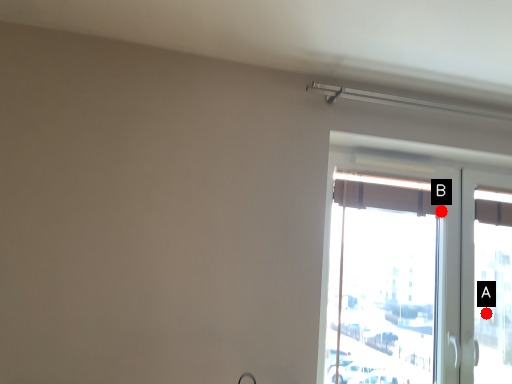
Question: Two points are circled on the image, labeled by A and B beside each circle. Among these points, which one is farthest from the camera?

Choices:
 (A) A is further
 (B) B is further

Answer: (B)